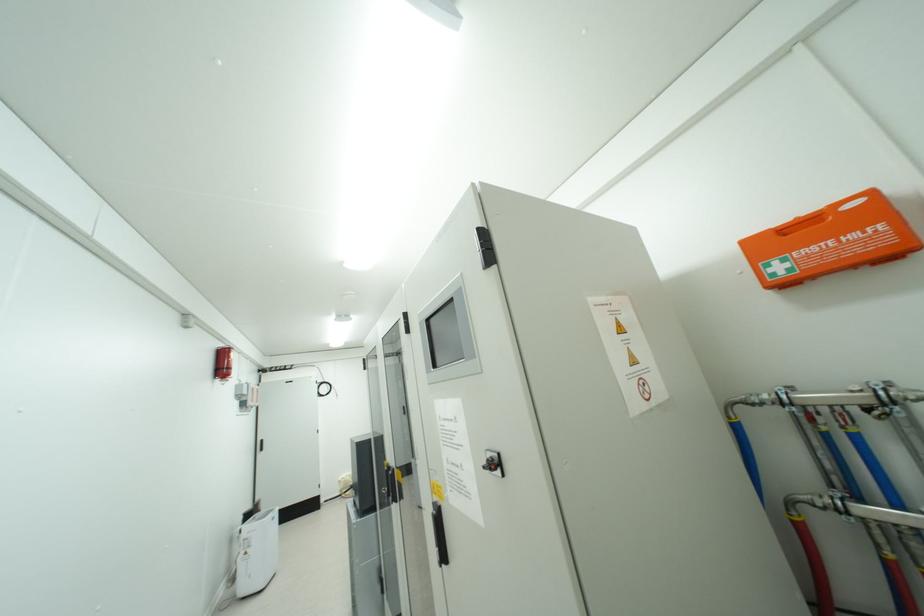
What do you see at coordinates (223, 363) in the screenshot? I see `the red valve handle` at bounding box center [223, 363].